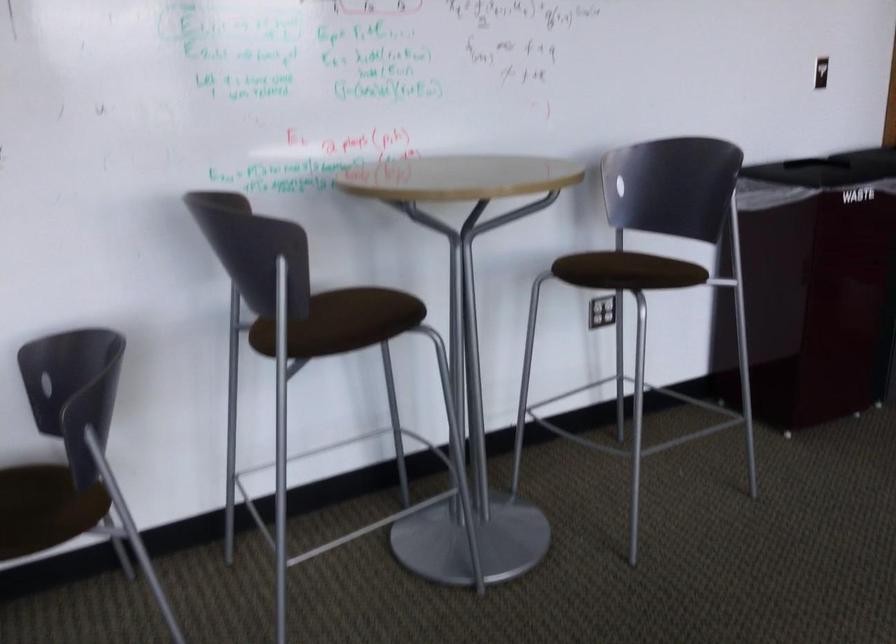
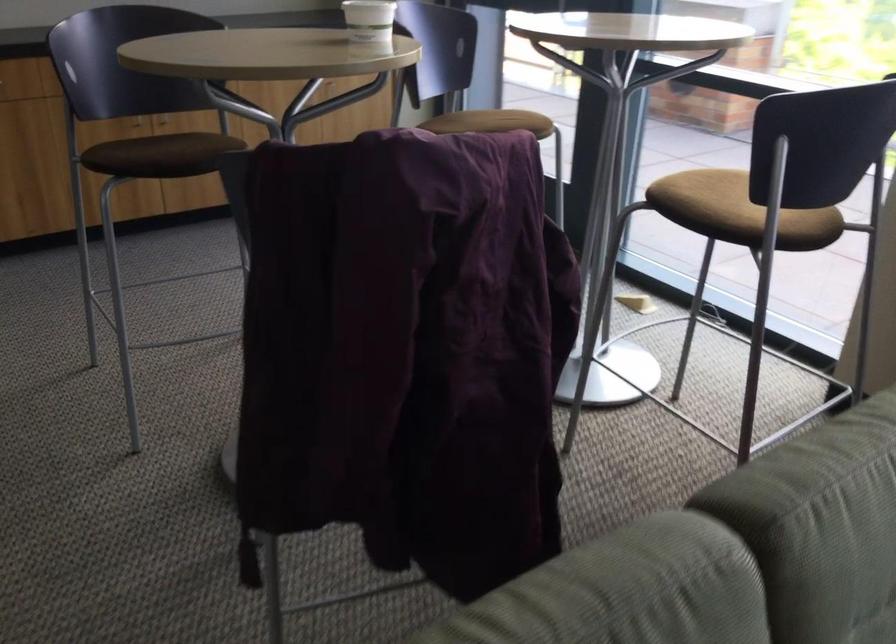
Based on the continuous images, in which direction is the camera rotating?

The rotation direction of the camera is right-down.